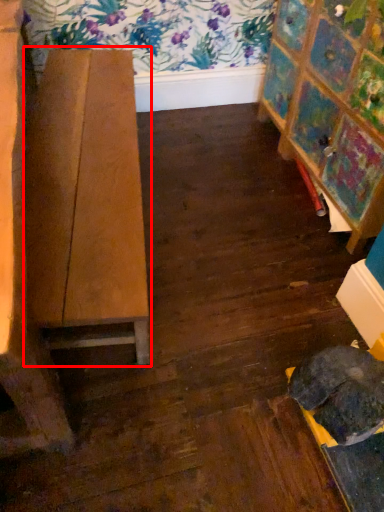
Question: From the image, what is the correct spatial relationship of table (annotated by the red box) in relation to furniture?

Choices:
 (A) left
 (B) right

Answer: (A)